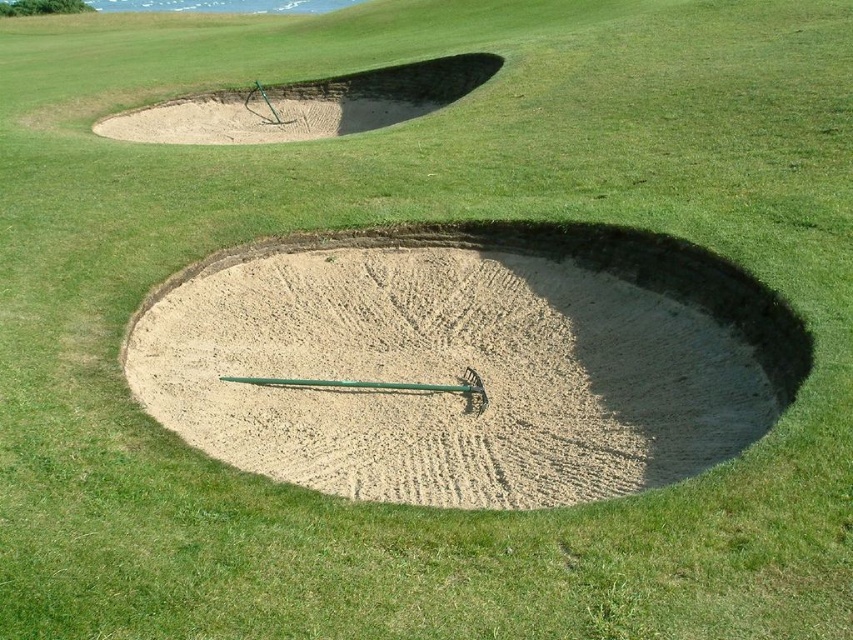
Consider the image. You are standing on the golf course and see two points marked on the sand bunkers. Which point is nearer to you, point (724, 285) or point (264, 140)?

Point (724, 285) is closer to the viewer than point (264, 140).